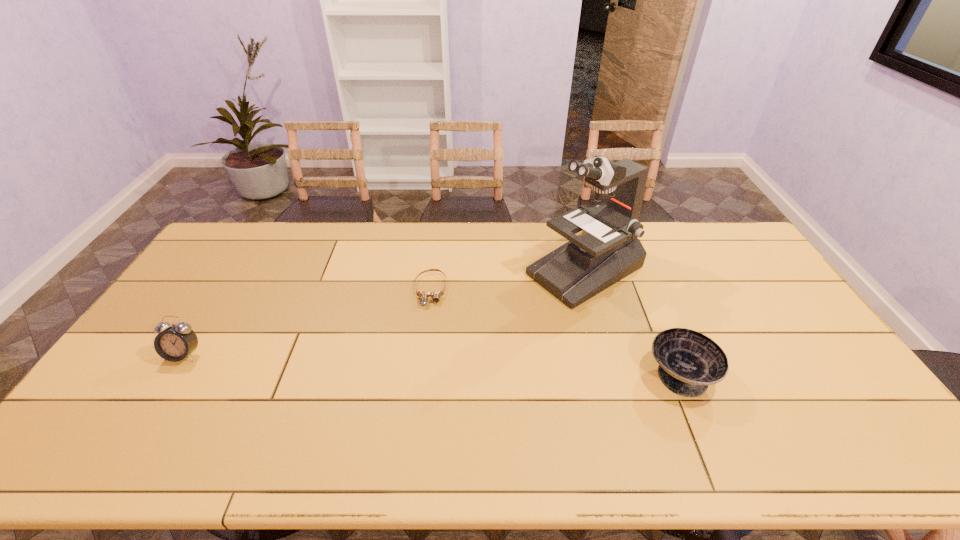
At what (x,y) coordinates should I click in order to perform the action: click on vacant space situated 0.280m through the eyepieces of the microscope. Please return your answer as a coordinate pair (x, y). Looking at the image, I should click on pos(471,332).

The image size is (960, 540). Identify the location of vacant space situated 0.170m on the front lenses and sides of the second object from left to right. (426, 351).

Where is `vacant space situated on the front lenses and sides of the second object from left to right`? The height and width of the screenshot is (540, 960). vacant space situated on the front lenses and sides of the second object from left to right is located at coordinates (426, 360).

Identify the location of free point located on the front lenses and sides of the second object from left to right. (428, 325).

The height and width of the screenshot is (540, 960). What are the coordinates of `object that is at the far edge` in the screenshot? It's located at (608, 249).

Locate an element on the screen. The width and height of the screenshot is (960, 540). object present at the near edge is located at coordinates (689, 361).

At what (x,y) coordinates should I click in order to perform the action: click on object that is at the left edge. Please return your answer as a coordinate pair (x, y). The height and width of the screenshot is (540, 960). Looking at the image, I should click on (177, 342).

The height and width of the screenshot is (540, 960). In the image, there is a desktop. In order to click on vacant space at the far edge in this screenshot , I will do click(x=382, y=231).

In the image, there is a desktop. At what (x,y) coordinates should I click in order to perform the action: click on vacant space at the near edge. Please return your answer as a coordinate pair (x, y). This screenshot has width=960, height=540. Looking at the image, I should click on (322, 410).

This screenshot has width=960, height=540. In the image, there is a desktop. What are the coordinates of `vacant space at the left edge` in the screenshot? It's located at (223, 269).